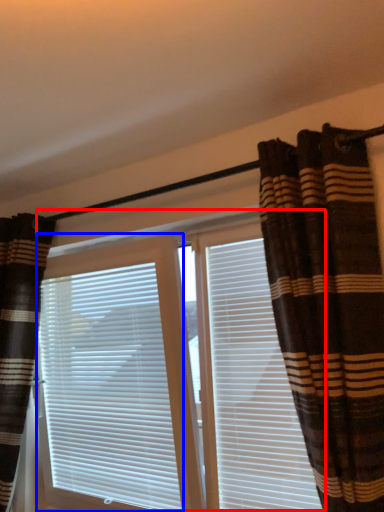
Question: Which of the following is the closest to the observer, bay window (highlighted by a red box) or window blind (highlighted by a blue box)?

Choices:
 (A) bay window
 (B) window blind

Answer: (A)